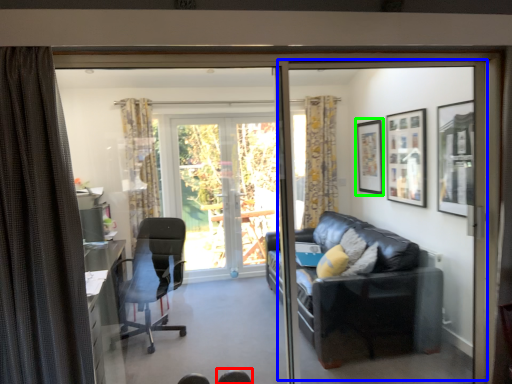
Question: Estimate the real-world distances between objects in this image. Which object is closer to chair (highlighted by a red box), screen door (highlighted by a blue box) or picture frame (highlighted by a green box)?

Choices:
 (A) screen door
 (B) picture frame

Answer: (B)